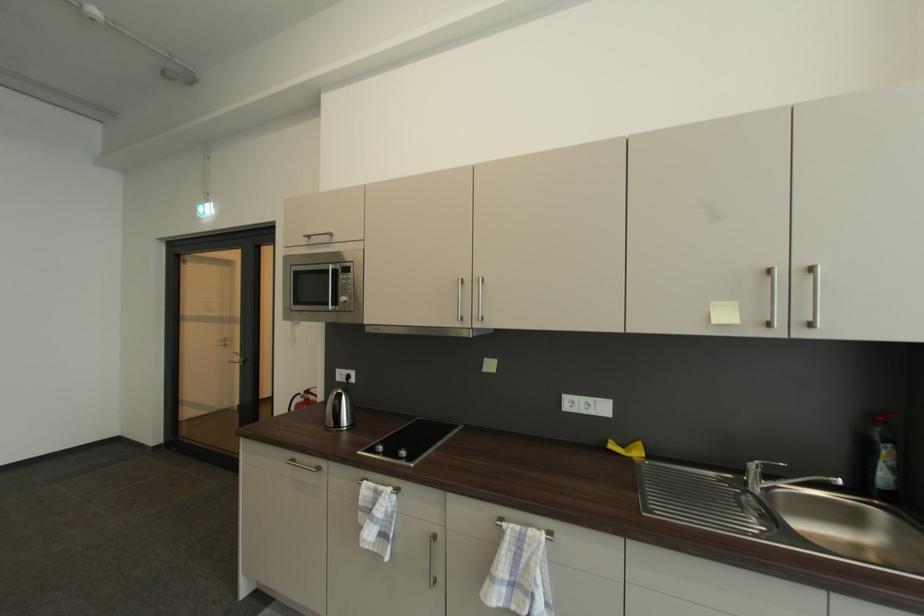
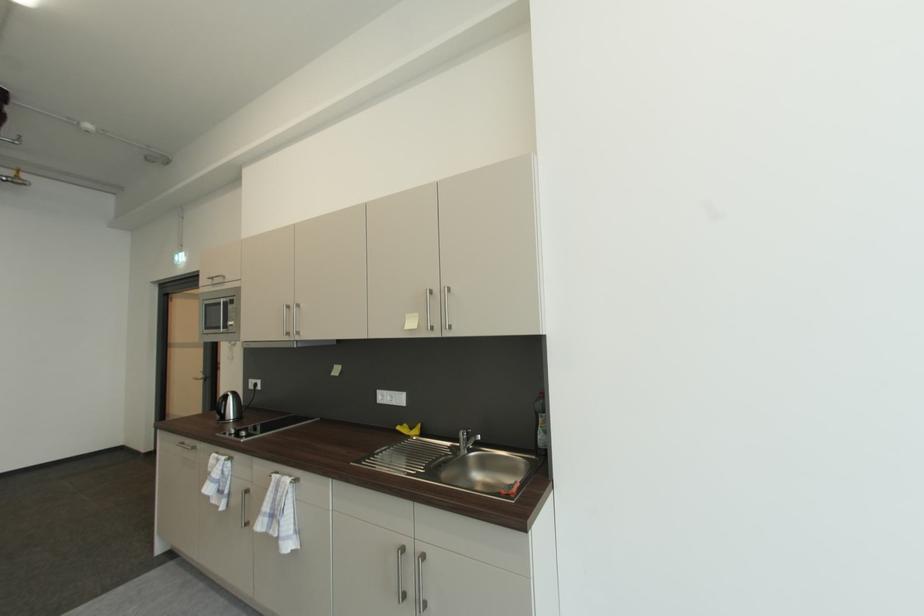
The point at (x=344, y=403) is marked in the first image. Where is the corresponding point in the second image?

(227, 402)